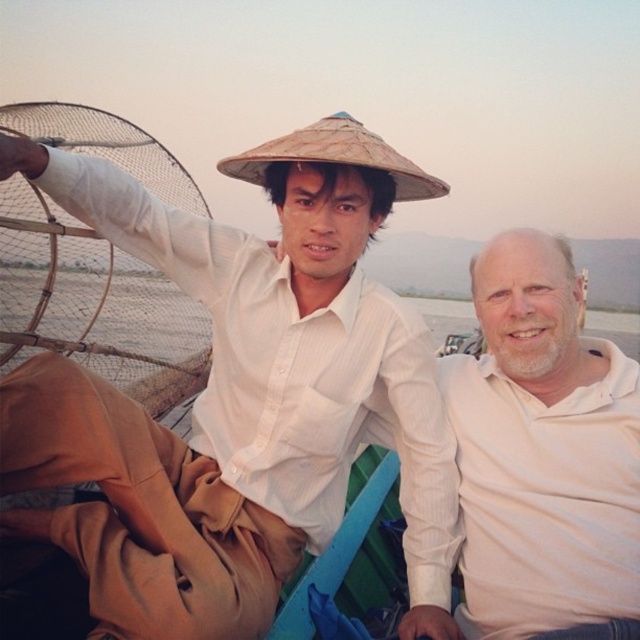
You are a photographer trying to capture a closeup shot of the brown mesh fishing net at left while also including the matte straw hat at upper center in the frame. Given that your camera can only focus on objects within a 5 feet range, will you be able to achieve this shot?

The matte straw hat at upper center is 4.79 feet from the brown mesh fishing net at left. Since the distance between them is within the 5 feet range, you can capture both in focus.